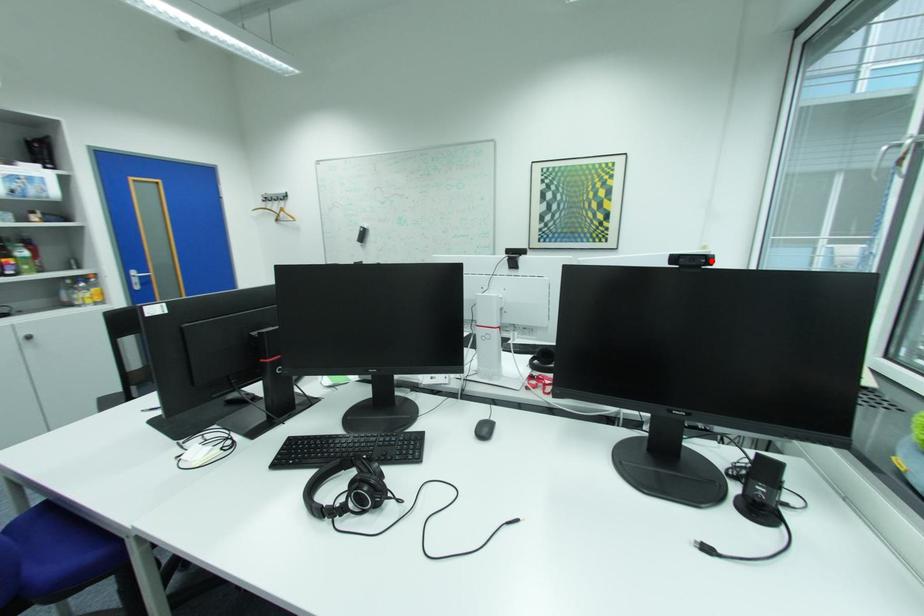
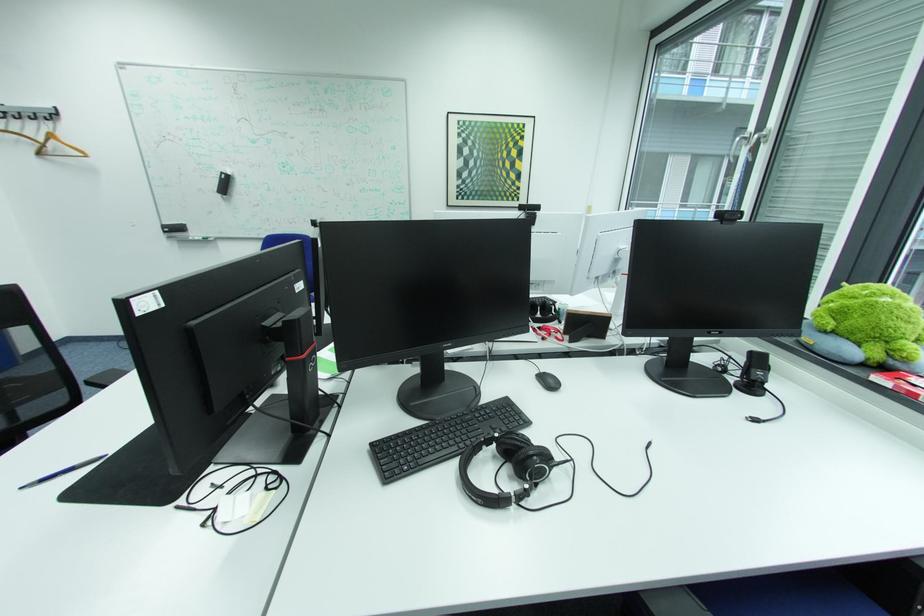
The point at the highlighted location is marked in the first image. Where is the corresponding point in the second image?

(748, 217)